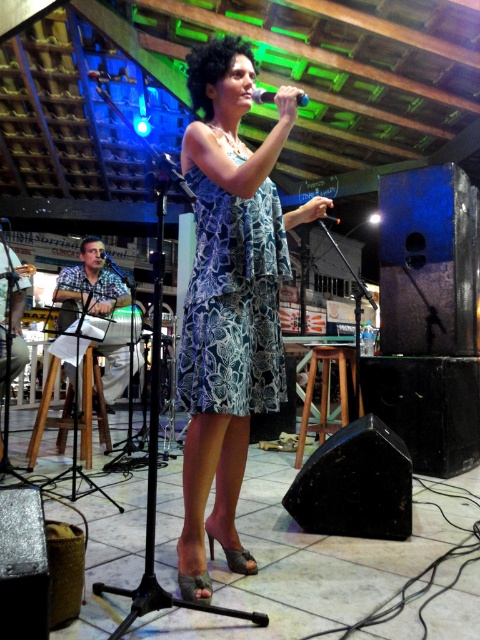
Is point (192, 156) positioned in front of point (352, 365)?

Yes.

Based on the photo, who is more forward, (250,387) or (314,356)?

Point (250,387) is more forward.

Where is `blue floral dress at center`? This screenshot has width=480, height=640. blue floral dress at center is located at coordinates (228, 300).

Does blue printed fabric dress at center appear on the left side of wooden stool at lower left?

No, blue printed fabric dress at center is not to the left of wooden stool at lower left.

Who is more forward, (283, 378) or (88, 358)?

Point (283, 378)

Describe the element at coordinates (233, 301) in the screenshot. I see `blue printed fabric dress at center` at that location.

Locate an element on the screen. The height and width of the screenshot is (640, 480). blue printed fabric dress at center is located at coordinates (233, 301).

Is blue printed fabric dress at center to the right of wooden stool at center from the viewer's perspective?

In fact, blue printed fabric dress at center is to the left of wooden stool at center.

Can you confirm if blue printed fabric dress at center is thinner than wooden stool at center?

Yes, blue printed fabric dress at center is thinner than wooden stool at center.

The image size is (480, 640). In order to click on blue printed fabric dress at center in this screenshot , I will do `click(233, 301)`.